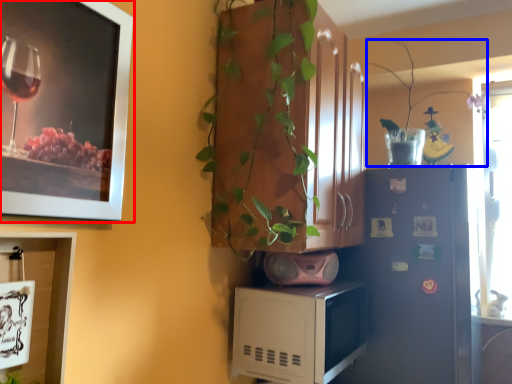
Question: Which object is further to the camera taking this photo, picture frame (highlighted by a red box) or plant (highlighted by a blue box)?

Choices:
 (A) picture frame
 (B) plant

Answer: (B)